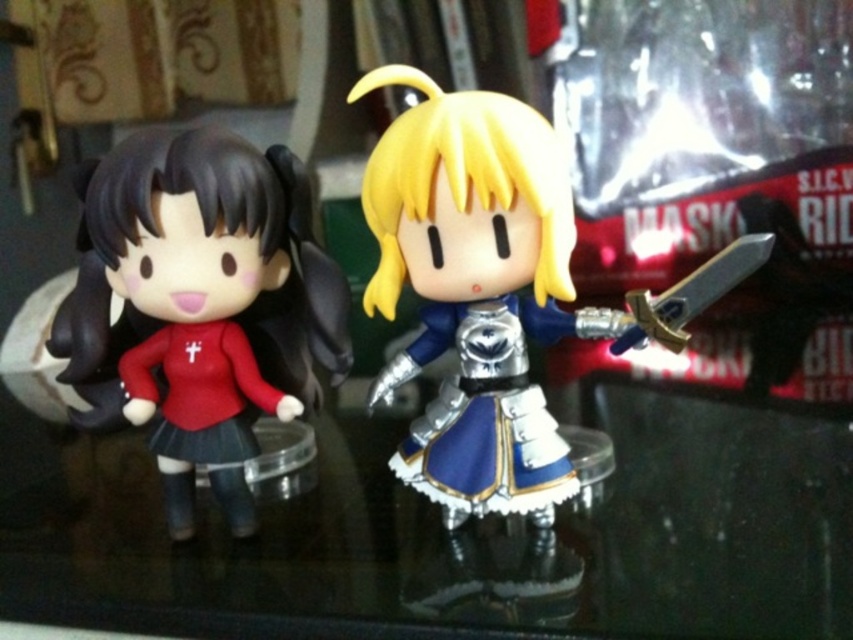
You are an artist trying to sketch the scene. You need to place the shiny silver armor at center and the shiny silver sword at right in your drawing. Based on the description, which object should be positioned to the left of the other?

The shiny silver armor at center is to the left of the shiny silver sword at right.

You are arranging these two items on a shelf. The shelf has a height limit of 10 cm. The matte red dress at left is 8 cm tall, and the shiny silver sword at right is 12 cm tall. Can both items fit on the shelf without exceeding the height limit?

The shiny silver sword at right is 12 cm tall, which exceeds the shelf height limit of 10 cm. Therefore, it cannot be placed on the shelf. The matte red dress at left is 8 cm tall and would fit, but the sword cannot be accommodated due to its height.

You are organizing a display and need to know the relative heights of the shiny silver armor at center and the matte red dress at left. Which one is taller?

The shiny silver armor at center is taller than the matte red dress at left according to the description.